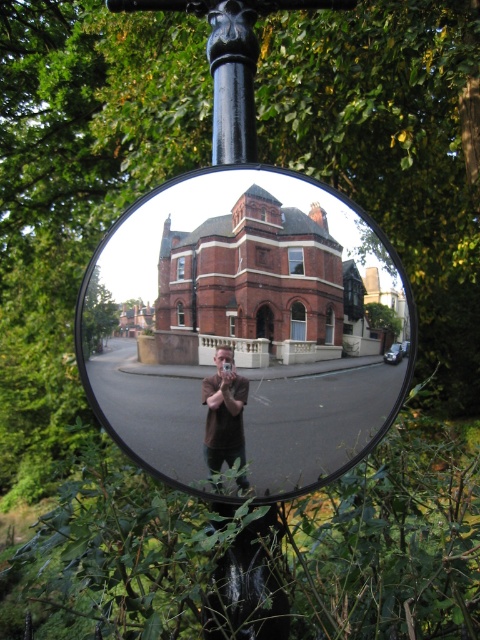
You are a photographer trying to capture a reflection in the matte glass mirror at center. You notice a brown leather jacket at center in the frame. Since the mirror is convex, will the jacket appear smaller or larger in the reflection compared to its actual size?

The matte glass mirror at center is bigger than brown leather jacket at center, so the convex mirror will make the brown leather jacket at center appear smaller in the reflection than its actual size.

You are standing in front of the circular convex mirror mounted on a black pole. You see a matte glass mirror at center and a brown leather jacket at center. Which object is positioned to the right when viewed from your perspective?

The matte glass mirror at center is to the right of the brown leather jacket at center.

Looking at this image, you are a photographer trying to capture a reflection in the matte glass mirror at center. You notice a brown leather jacket at center in the frame. Where should you position yourself to ensure the jacket is fully visible in the mirror?

The matte glass mirror at center is above the brown leather jacket at center, so positioning yourself below the mirror will allow you to see the jacket in its reflection.